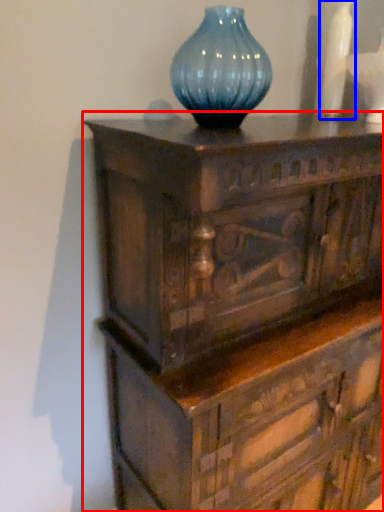
Question: Which point is further to the camera, chest of drawers (highlighted by a red box) or vase (highlighted by a blue box)?

Choices:
 (A) chest of drawers
 (B) vase

Answer: (B)